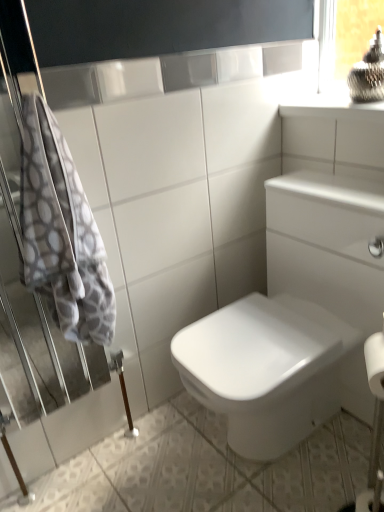
Question: Considering the relative sizes of white glossy ceramic tile at center and white textured towel at left in the image provided, is white glossy ceramic tile at center bigger than white textured towel at left?

Choices:
 (A) yes
 (B) no

Answer: (B)

Question: Is white textured towel at left at the back of white glossy ceramic tile at center?

Choices:
 (A) no
 (B) yes

Answer: (A)

Question: Can you confirm if white glossy ceramic tile at center is smaller than white textured towel at left?

Choices:
 (A) yes
 (B) no

Answer: (A)

Question: Does white glossy ceramic tile at center come behind white textured towel at left?

Choices:
 (A) yes
 (B) no

Answer: (B)

Question: Is white glossy ceramic tile at center touching white textured towel at left?

Choices:
 (A) yes
 (B) no

Answer: (B)

Question: From the image's perspective, is clear glass window frame at upper right above or below white glossy ceramic tile at center?

Choices:
 (A) below
 (B) above

Answer: (B)

Question: From a real-world perspective, is clear glass window frame at upper right physically located above or below white glossy ceramic tile at center?

Choices:
 (A) above
 (B) below

Answer: (A)

Question: Is clear glass window frame at upper right situated inside white glossy ceramic tile at center or outside?

Choices:
 (A) inside
 (B) outside

Answer: (B)

Question: Based on their positions, is clear glass window frame at upper right located to the left or right of white glossy ceramic tile at center?

Choices:
 (A) left
 (B) right

Answer: (B)

Question: In terms of height, does white glossy ceramic tile at center look taller or shorter compared to clear glass window frame at upper right?

Choices:
 (A) tall
 (B) short

Answer: (B)

Question: In terms of width, does white glossy ceramic tile at center look wider or thinner when compared to clear glass window frame at upper right?

Choices:
 (A) thin
 (B) wide

Answer: (B)

Question: Is white glossy ceramic tile at center to the left or to the right of clear glass window frame at upper right in the image?

Choices:
 (A) right
 (B) left

Answer: (B)

Question: From a real-world perspective, is white glossy ceramic tile at center physically located above or below clear glass window frame at upper right?

Choices:
 (A) below
 (B) above

Answer: (A)

Question: From a real-world perspective, is clear glass window frame at upper right physically located above or below white textured towel at left?

Choices:
 (A) above
 (B) below

Answer: (A)

Question: From the image's perspective, is clear glass window frame at upper right above or below white textured towel at left?

Choices:
 (A) above
 (B) below

Answer: (A)